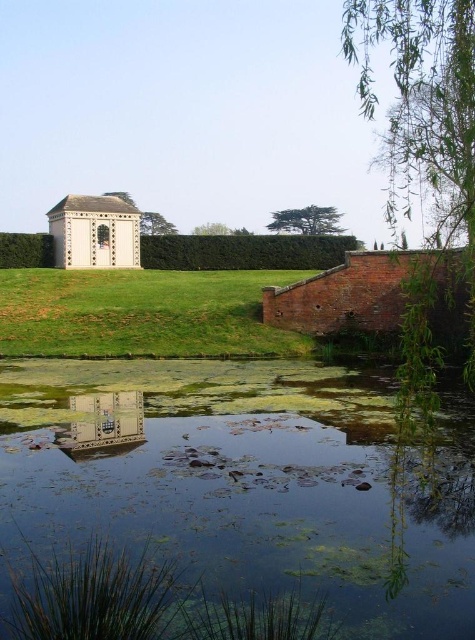
You are standing in the garden and want to walk from the green grassy at center to the clear water at pond center. Which direction should you move to reach the water?

You should move downward to reach the clear water at pond center because it is positioned under the green grassy at center.

Consider the image. You are standing at the edge of the pond in the garden scene. You want to find the exact center point of the clear water at pond center. According to the coordinates provided, what are the coordinates of this center point?

The coordinates of the clear water at pond center are at point (245, 483).